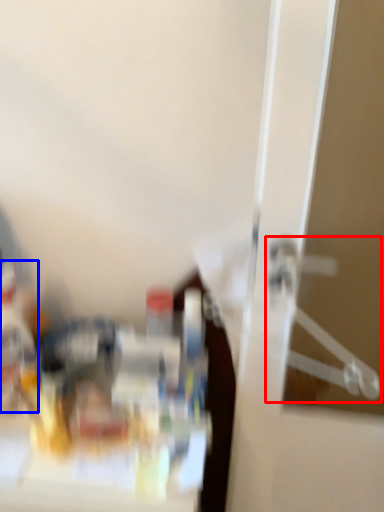
Question: Which object is closer to the camera taking this photo, hanger (highlighted by a red box) or bottle (highlighted by a blue box)?

Choices:
 (A) hanger
 (B) bottle

Answer: (A)